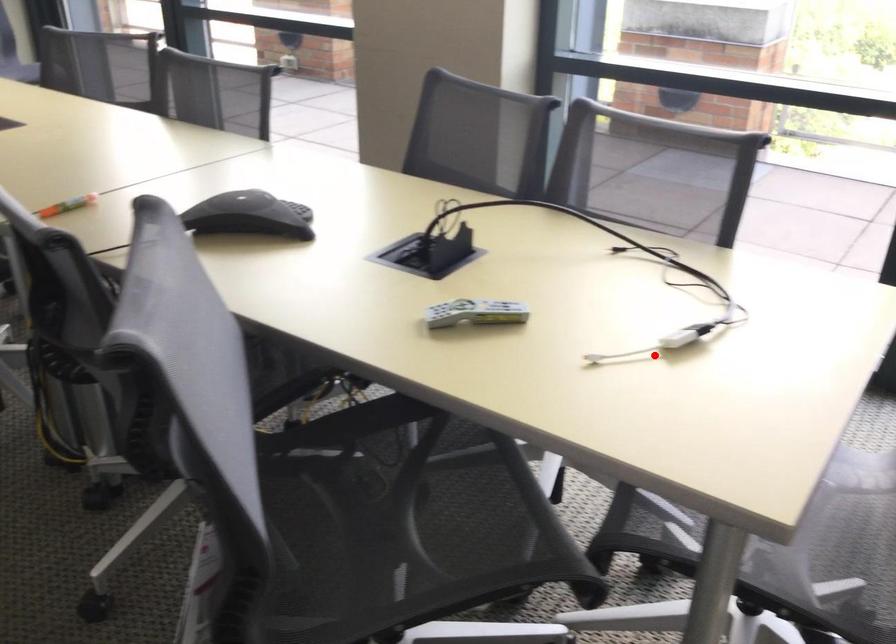
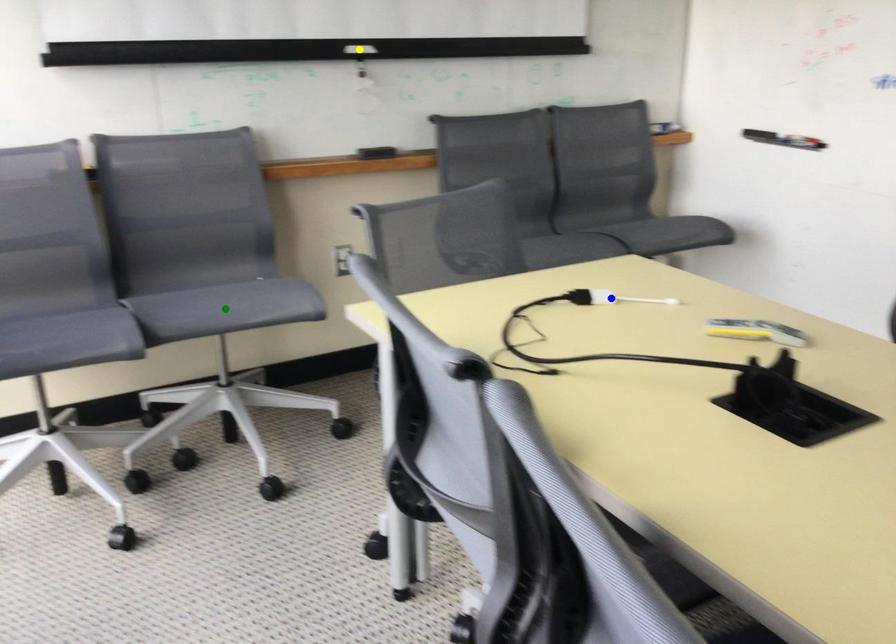
Question: I am providing you with two images of the same scene from different viewpoints. A red point is marked on the first image. You are given multiple points on the second image. In image 2, which mark is for the same physical point as the one in image 1?

Choices:
 (A) yellow point
 (B) green point
 (C) blue point

Answer: (C)